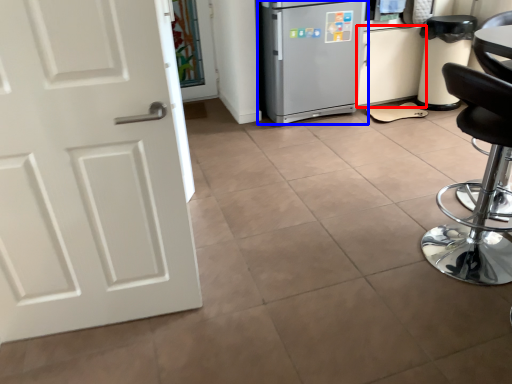
Question: Among these objects, which one is farthest to the camera, cabinetry (highlighted by a red box) or refrigerator (highlighted by a blue box)?

Choices:
 (A) cabinetry
 (B) refrigerator

Answer: (A)